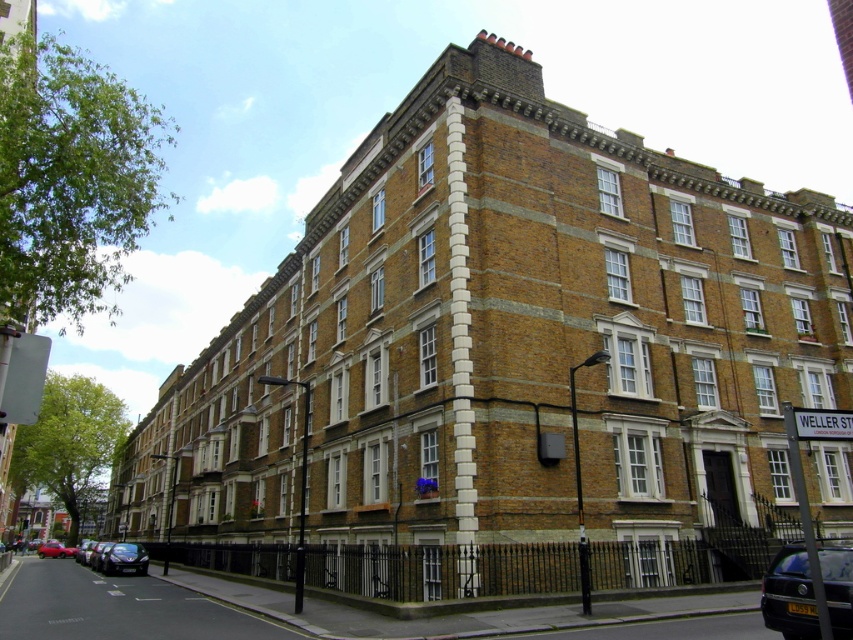
Can you confirm if shiny black car at lower left is positioned below shiny red car at lower left?

No.

Is shiny black car at lower left positioned at the back of shiny red car at lower left?

No, it is not.

Find the location of a particular element. shiny black car at lower left is located at coordinates (125, 557).

Image resolution: width=853 pixels, height=640 pixels. Identify the location of shiny black car at lower left. (125, 557).

Does black metallic car at lower right have a lesser width compared to shiny red car at lower left?

Yes.

Which is behind, point (801, 554) or point (51, 545)?

Point (51, 545)

Where is `black metallic car at lower right`? This screenshot has height=640, width=853. black metallic car at lower right is located at coordinates (788, 595).

In order to click on black metallic car at lower right in this screenshot , I will do `click(788, 595)`.

Can you confirm if black metallic car at lower right is smaller than shiny black car at lower left?

Yes.

Does black metallic car at lower right come in front of shiny black car at lower left?

Yes, it is in front of shiny black car at lower left.

Is point (802, 556) closer to viewer compared to point (112, 545)?

Yes, it is.

Locate an element on the screen. This screenshot has height=640, width=853. black metallic car at lower right is located at coordinates (788, 595).